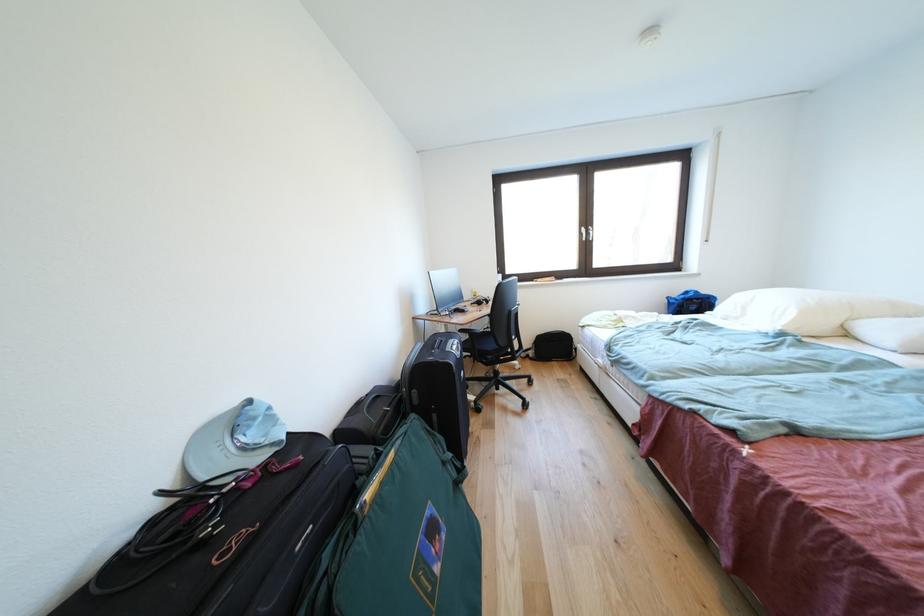
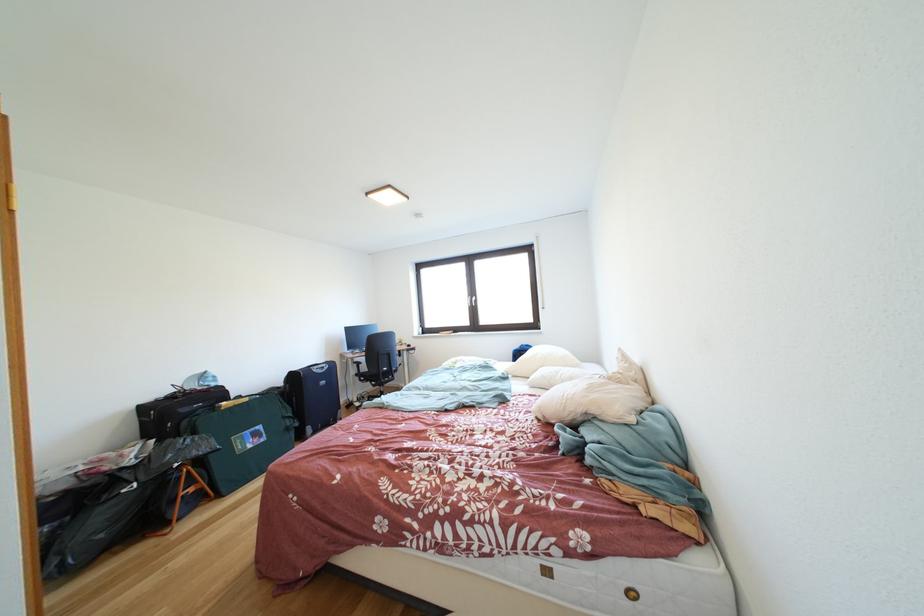
Locate, in the second image, the point that corresponds to [495,369] in the first image.

(383, 391)